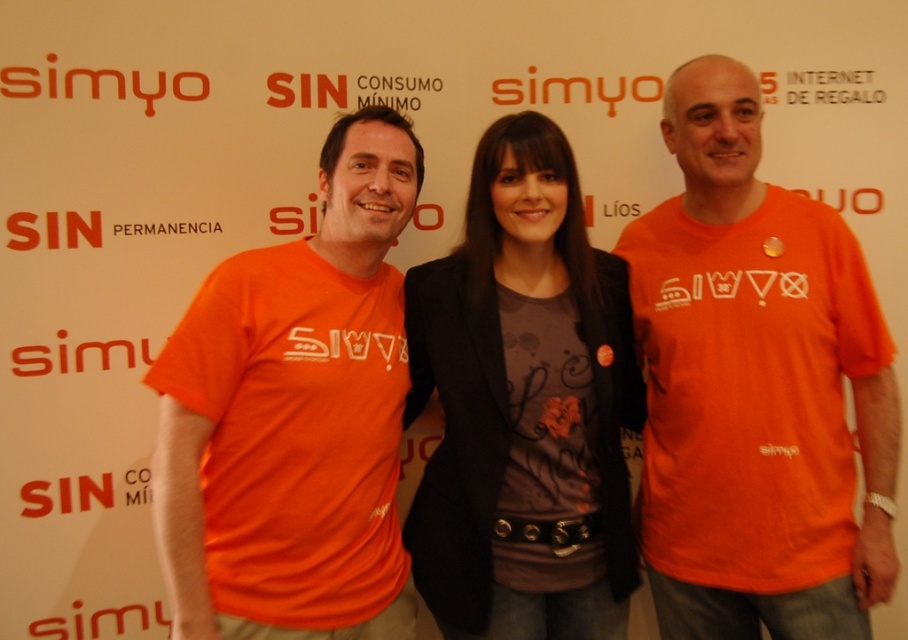
Question: Does orange matte t-shirt at center have a larger size compared to matte black blazer at center?

Choices:
 (A) no
 (B) yes

Answer: (B)

Question: Which object is the closest to the orange matte t-shirt at center?

Choices:
 (A) matte black blazer at center
 (B) orange matte t-shirt at left

Answer: (A)

Question: Which of these objects is positioned closest to the orange matte t-shirt at center?

Choices:
 (A) orange matte t-shirt at left
 (B) matte black blazer at center

Answer: (B)

Question: Can you confirm if orange matte t-shirt at center is positioned below orange matte t-shirt at left?

Choices:
 (A) yes
 (B) no

Answer: (B)

Question: Considering the real-world distances, which object is closest to the orange matte t-shirt at left?

Choices:
 (A) matte black blazer at center
 (B) orange matte t-shirt at center

Answer: (A)

Question: Can you confirm if orange matte t-shirt at center is bigger than orange matte t-shirt at left?

Choices:
 (A) yes
 (B) no

Answer: (B)